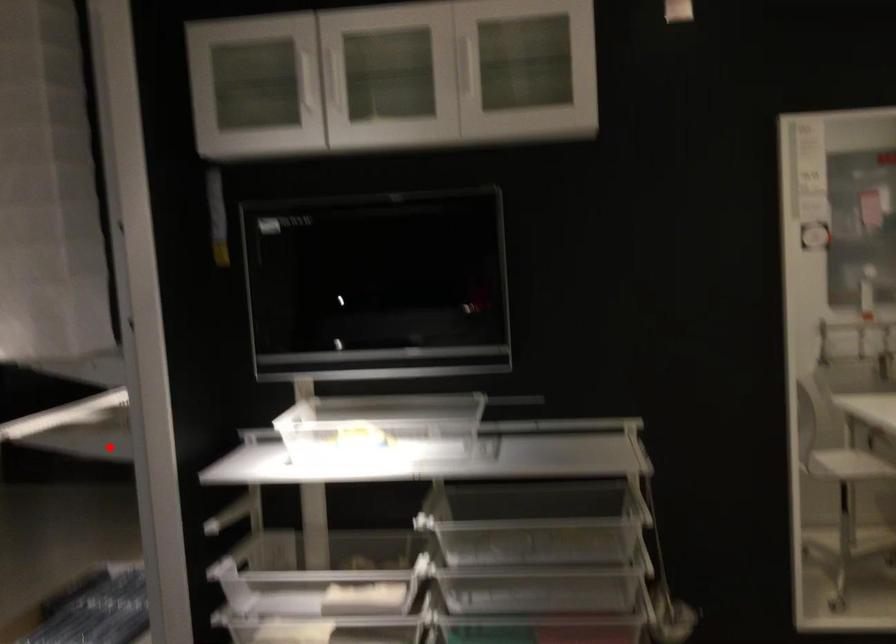
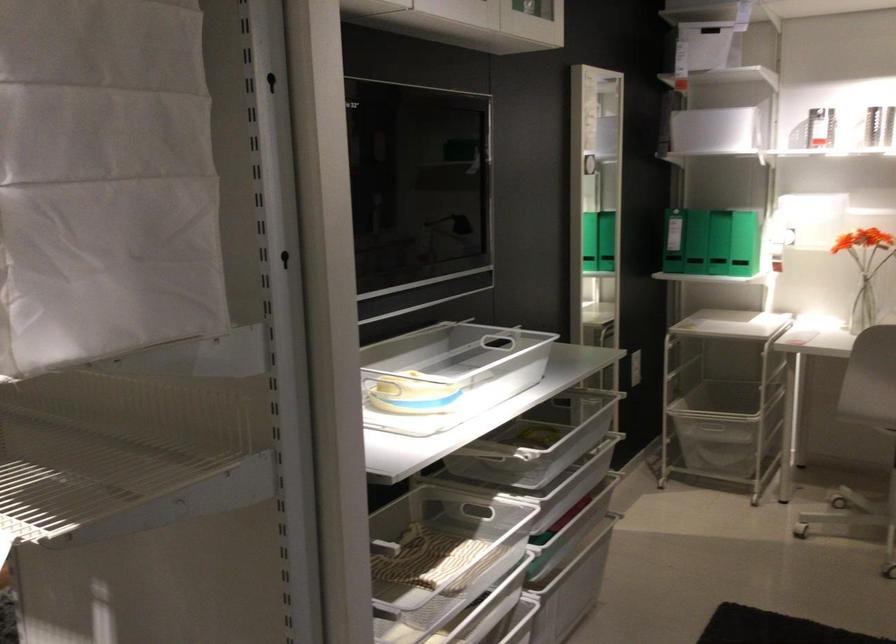
Question: I am providing you with two images of the same scene from different viewpoints. In image1, a red point is highlighted. Considering the same 3D point in image2, which of the following is correct?

Choices:
 (A) It is closer
 (B) It is farther

Answer: (A)